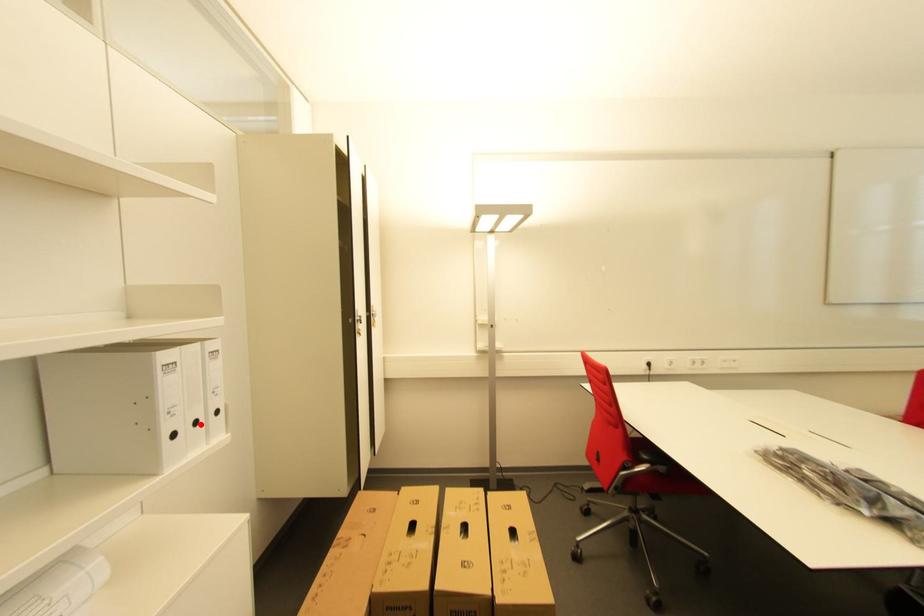
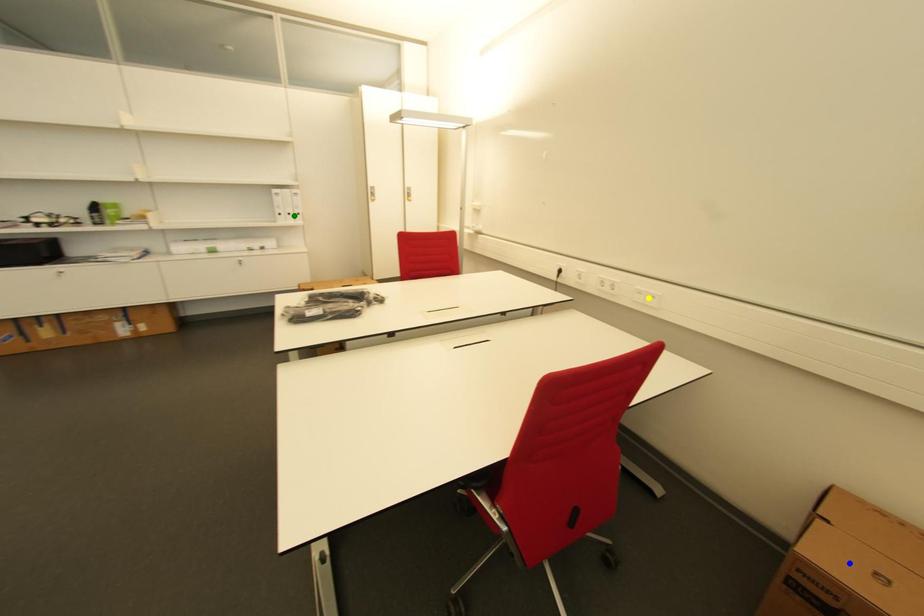
Question: I am providing you with two images of the same scene from different viewpoints. A red point is marked on the first image. You are given multiple points on the second image. Which mark in image 2 goes with the point in image 1?

Choices:
 (A) blue point
 (B) green point
 (C) yellow point

Answer: (B)